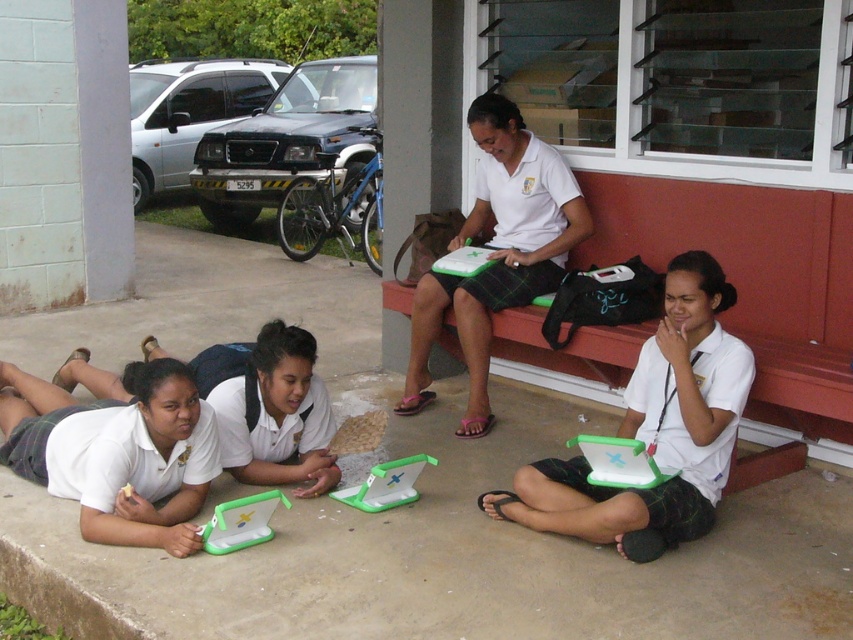
Question: Which point is closer to the camera taking this photo?

Choices:
 (A) (250, 436)
 (B) (27, 400)
 (C) (554, 460)

Answer: (C)

Question: Considering the relative positions of matte green plastic laptop at lower left and white matte laptop at center in the image provided, where is matte green plastic laptop at lower left located with respect to white matte laptop at center?

Choices:
 (A) below
 (B) above

Answer: (A)

Question: Does matte white laptop at center appear under white matte uniform at lower left?

Choices:
 (A) yes
 (B) no

Answer: (B)

Question: Does matte green plastic laptop at lower left appear under white matte uniform at lower left?

Choices:
 (A) yes
 (B) no

Answer: (A)

Question: Estimate the real-world distances between objects in this image. Which object is closer to the white matte laptop at center?

Choices:
 (A) matte white laptop at center
 (B) white matte uniform at lower left

Answer: (B)

Question: Which point is closer to the camera taking this photo?

Choices:
 (A) (396, 403)
 (B) (180, 380)

Answer: (B)